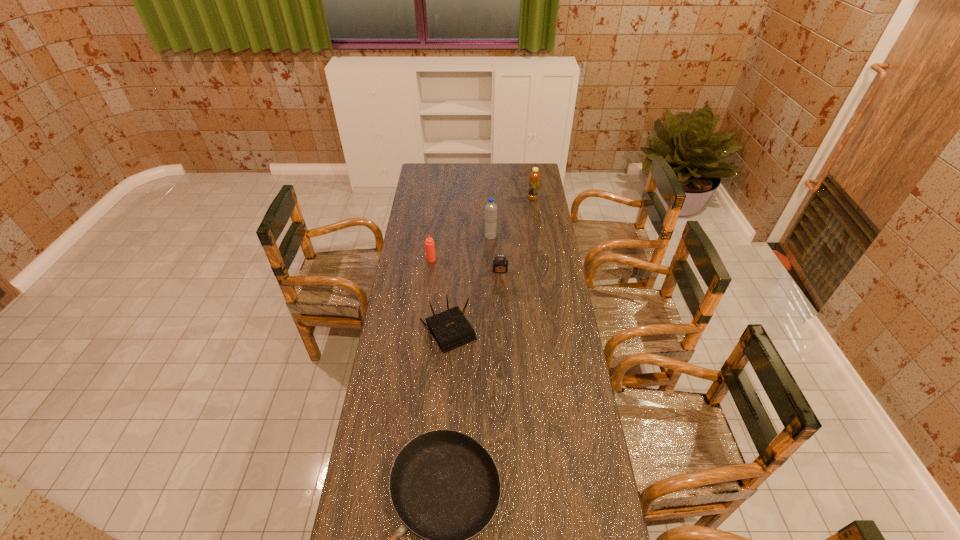
This screenshot has height=540, width=960. Identify the location of the tallest object. (490, 208).

At what (x,y) coordinates should I click in order to perform the action: click on the fifth nearest object. Please return your answer as a coordinate pair (x, y). The height and width of the screenshot is (540, 960). Looking at the image, I should click on (490, 208).

The image size is (960, 540). I want to click on the farthest object, so click(534, 177).

Locate an element on the screen. bottle is located at coordinates (534, 177).

Image resolution: width=960 pixels, height=540 pixels. In order to click on the third farthest object in this screenshot , I will do `click(429, 243)`.

Locate an element on the screen. The image size is (960, 540). Tabasco sauce is located at coordinates (429, 243).

The width and height of the screenshot is (960, 540). What are the coordinates of `padlock` in the screenshot? It's located at (499, 266).

Locate an element on the screen. The width and height of the screenshot is (960, 540). the second nearest object is located at coordinates (450, 329).

This screenshot has width=960, height=540. Identify the location of vacant space situated 0.240m on the left of the tallest object. (438, 237).

Image resolution: width=960 pixels, height=540 pixels. Identify the location of vacant space located on the back of the fifth shortest object. (529, 171).